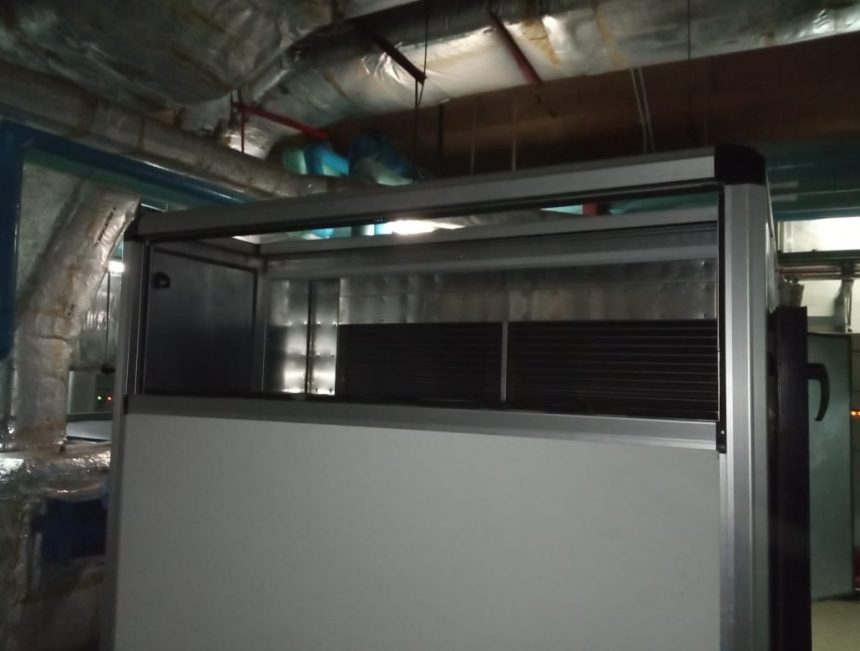
Identify the location of light. (414, 221).